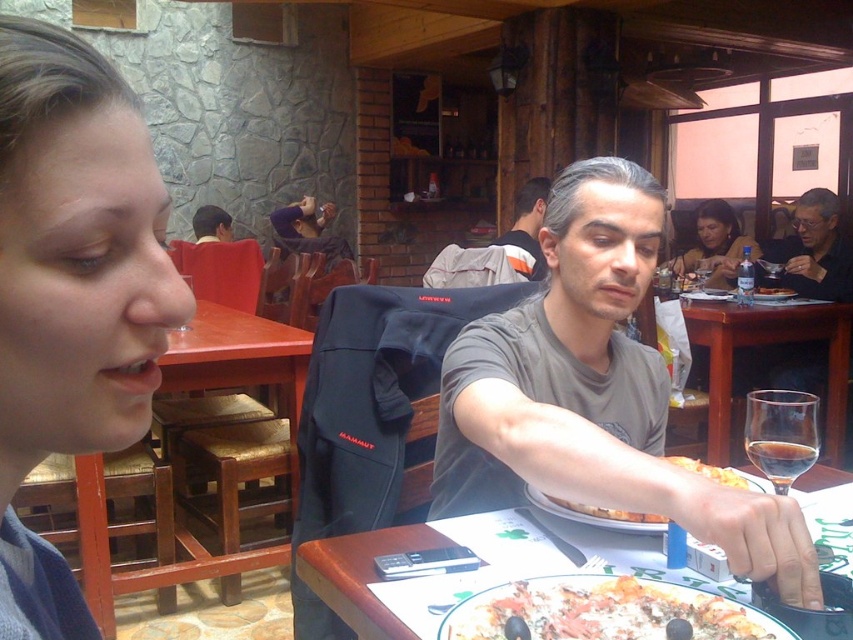
Consider the image. Can you confirm if transparent glass at center is positioned below matte black jacket at upper right?

Yes, transparent glass at center is below matte black jacket at upper right.

Between transparent glass at center and matte black jacket at upper right, which one appears on the left side from the viewer's perspective?

From the viewer's perspective, transparent glass at center appears more on the left side.

Find the location of `transparent glass at center`. transparent glass at center is located at coordinates (769, 342).

Which is more to the right, gray matte t-shirt at center or transparent glass at center?

transparent glass at center is more to the right.

Is gray matte t-shirt at center below transparent glass at center?

No, gray matte t-shirt at center is not below transparent glass at center.

I want to click on gray matte t-shirt at center, so click(595, 392).

Where is `gray matte t-shirt at center`? gray matte t-shirt at center is located at coordinates (595, 392).

From the picture: Who is more forward, (692, 460) or (198, 212)?

Point (692, 460)

Can you confirm if golden crispy pizza at lower center is positioned to the right of reddish-brown leather jacket at upper left?

Correct, you'll find golden crispy pizza at lower center to the right of reddish-brown leather jacket at upper left.

Is point (527, 486) positioned before point (192, 221)?

Yes.

Locate an element on the screen. golden crispy pizza at lower center is located at coordinates [606, 513].